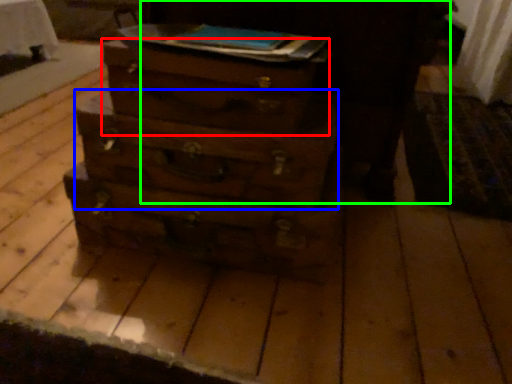
Question: Considering the real-world distances, which object is farthest from drawer (highlighted by a red box)? drawer (highlighted by a blue box) or dark (highlighted by a green box)?

Choices:
 (A) drawer
 (B) dark

Answer: (B)